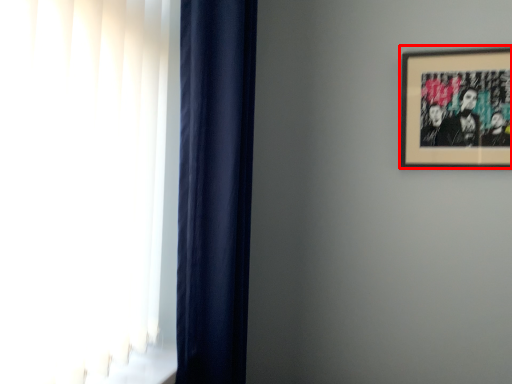
Question: Where is picture frame (annotated by the red box) located in relation to curtain in the image?

Choices:
 (A) left
 (B) right

Answer: (B)